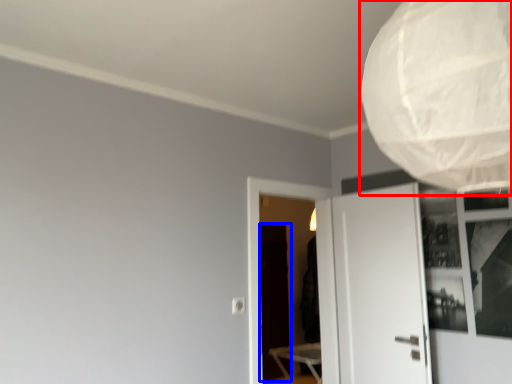
Question: Among these objects, which one is farthest to the camera, lamp (highlighted by a red box) or screen door (highlighted by a blue box)?

Choices:
 (A) lamp
 (B) screen door

Answer: (B)